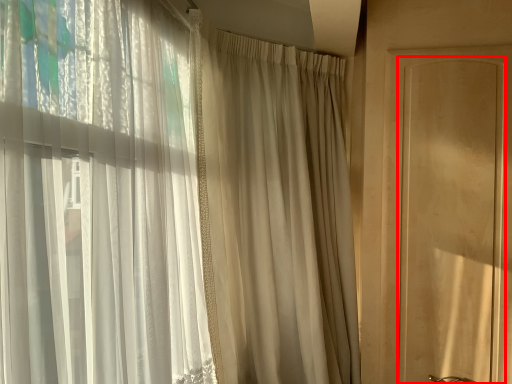
Question: From the image, what is the correct spatial relationship of screen door (annotated by the red box) in relation to curtain?

Choices:
 (A) right
 (B) left

Answer: (A)